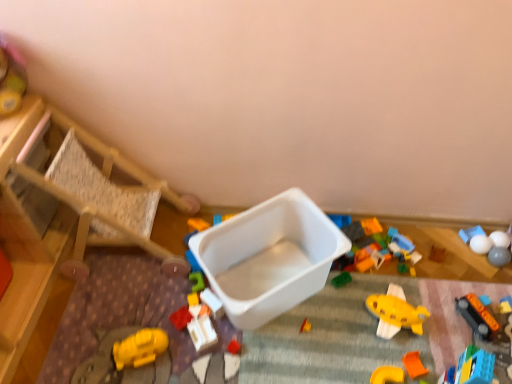
I want to click on vacant area situated to the left side of yellow matte airplane at center, which appears as the 7th toy when viewed from the left, so click(336, 327).